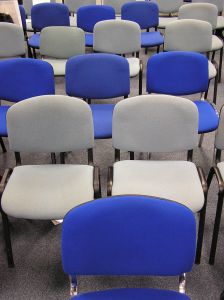
Where is `chair legs`? chair legs is located at coordinates (219, 211), (199, 250), (9, 249).